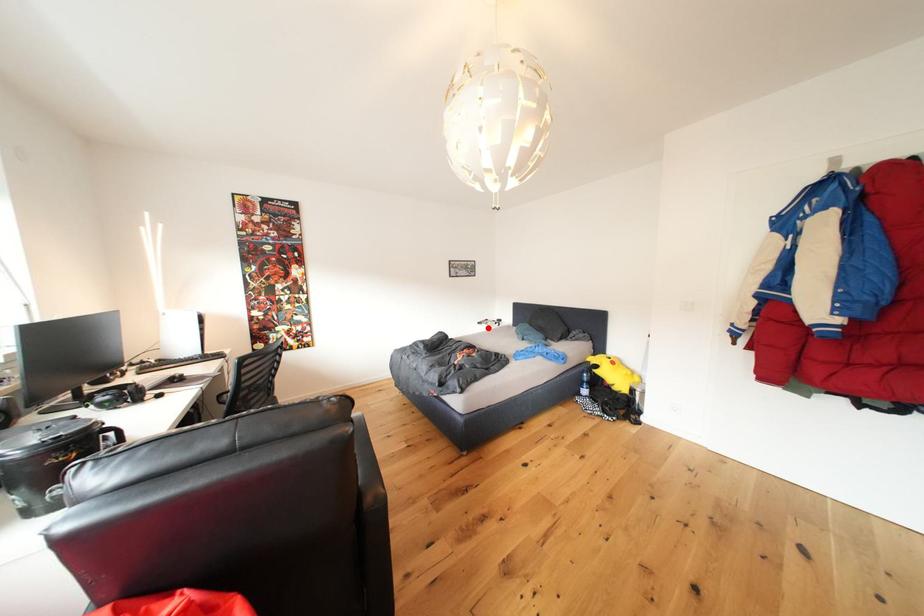
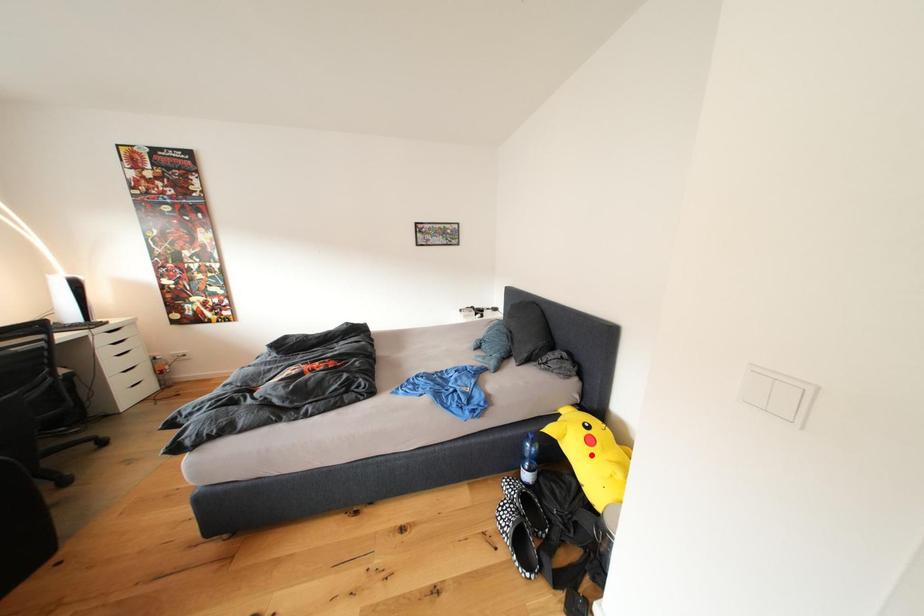
I am providing you with two images of the same scene from different viewpoints. A red point is marked on the first image and another point is marked on the second image. Does the point marked in image1 correspond to the same location as the one in image2?

No